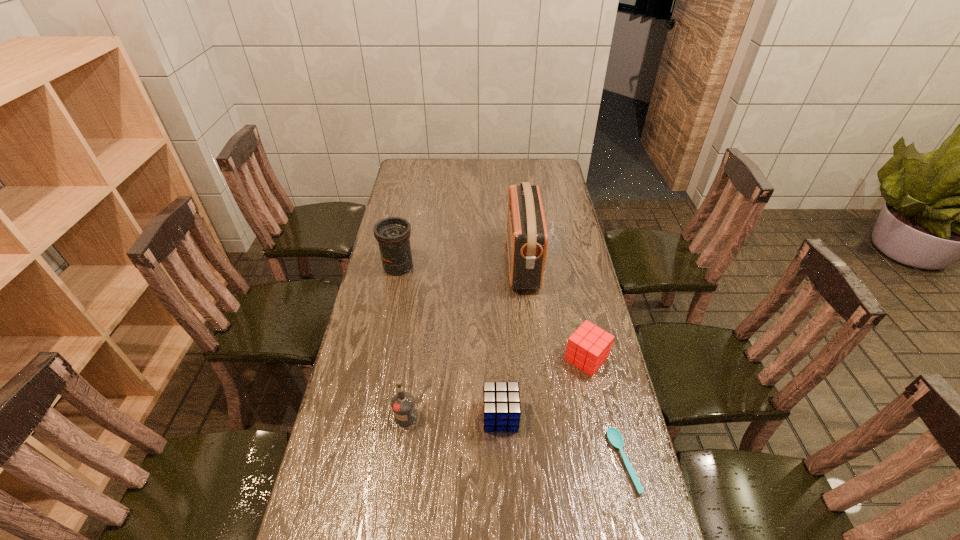
Where is `free region located on the front-facing side of the radio receiver`? This screenshot has height=540, width=960. free region located on the front-facing side of the radio receiver is located at coordinates (459, 262).

Where is `blank area located 0.120m on the front-facing side of the radio receiver`? The width and height of the screenshot is (960, 540). blank area located 0.120m on the front-facing side of the radio receiver is located at coordinates (477, 262).

Where is `vacant point located on the front of the telephoto lens`? The width and height of the screenshot is (960, 540). vacant point located on the front of the telephoto lens is located at coordinates (394, 291).

Image resolution: width=960 pixels, height=540 pixels. Identify the location of vacant space situated 0.180m on the front label of the vodka. (396, 496).

Image resolution: width=960 pixels, height=540 pixels. I want to click on vacant space located on the front of the third farthest object, so click(620, 516).

I want to click on free space located 0.300m on the left of the third object from left to right, so click(376, 416).

Locate an element on the screen. vacant space located on the back of the spoon is located at coordinates (598, 359).

Locate an element on the screen. object positioned at the left edge is located at coordinates (393, 234).

Image resolution: width=960 pixels, height=540 pixels. In order to click on cube located at the right edge in this screenshot , I will do `click(588, 348)`.

Where is `spoon that is positioned at the right edge`? This screenshot has width=960, height=540. spoon that is positioned at the right edge is located at coordinates (614, 436).